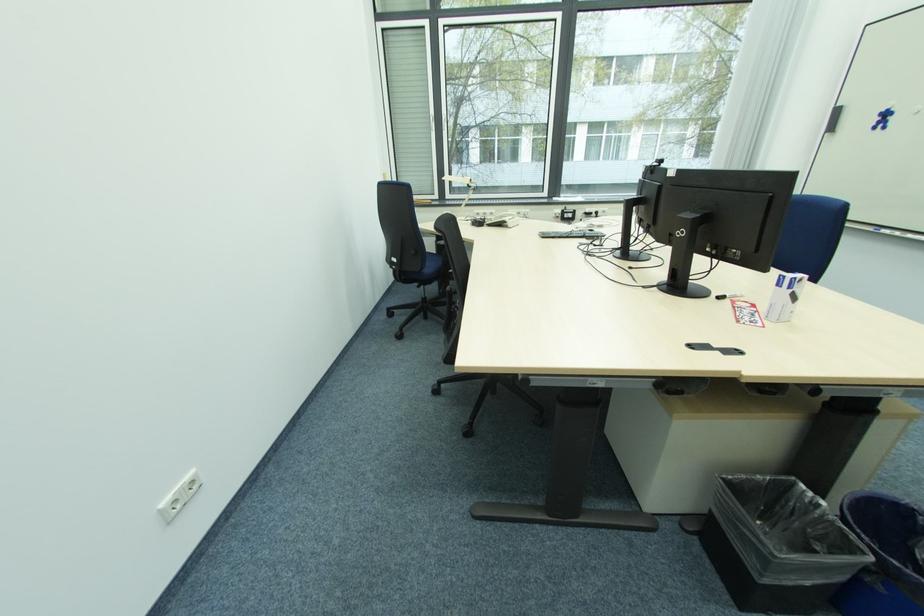
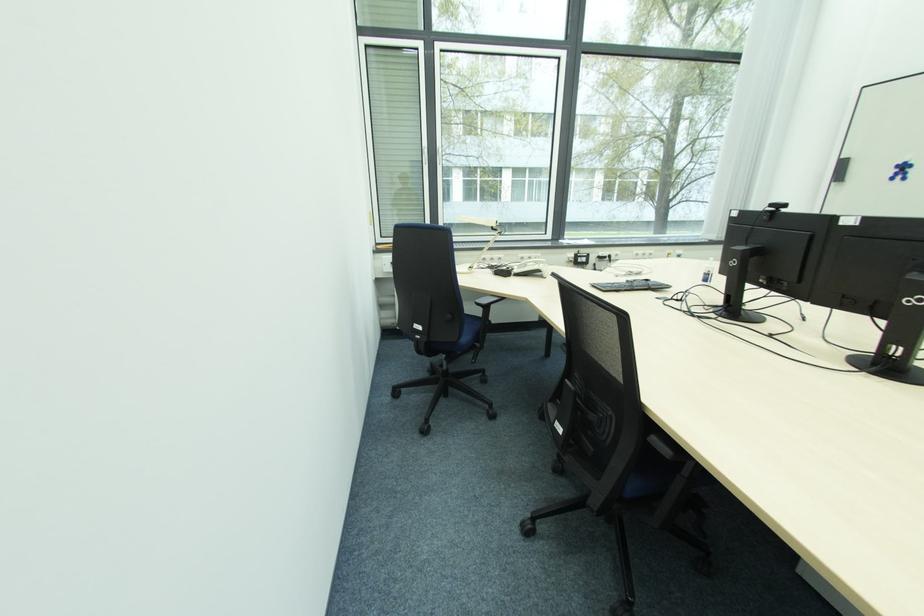
Find the pixel in the second image that matches point (427, 272) in the first image.

(463, 341)